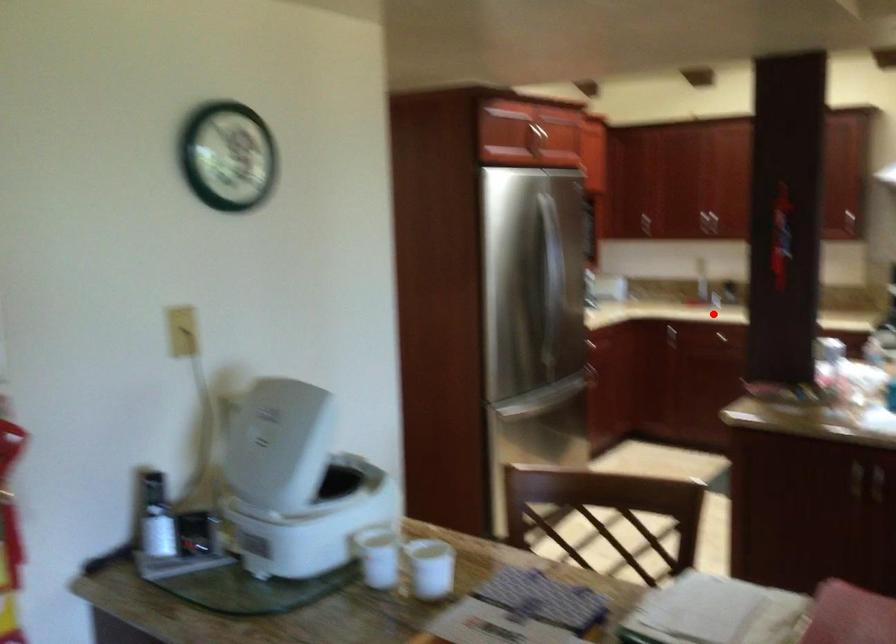
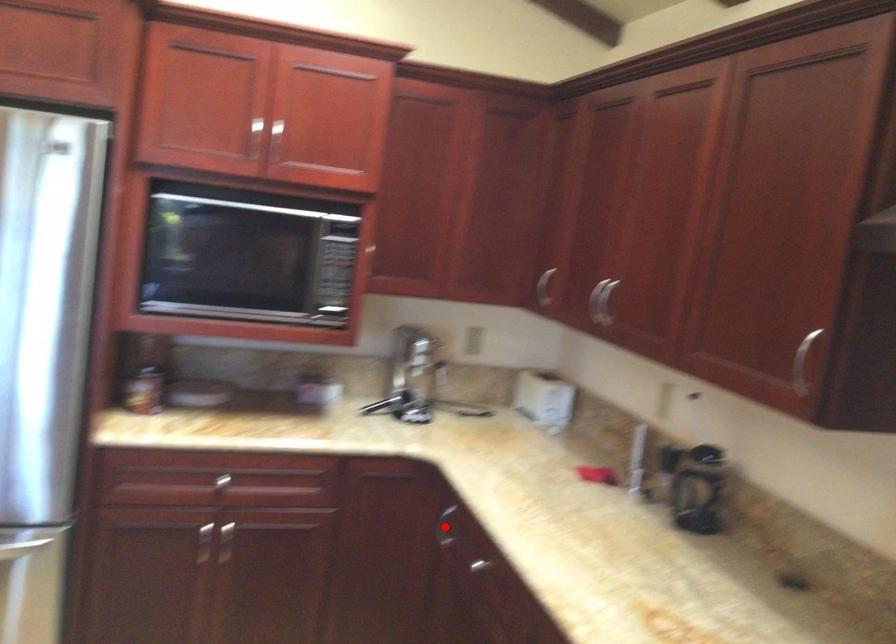
I am providing you with two images of the same scene from different viewpoints. A red point is marked on the first image and another point is marked on the second image. Do the highlighted points in image1 and image2 indicate the same real-world spot?

No